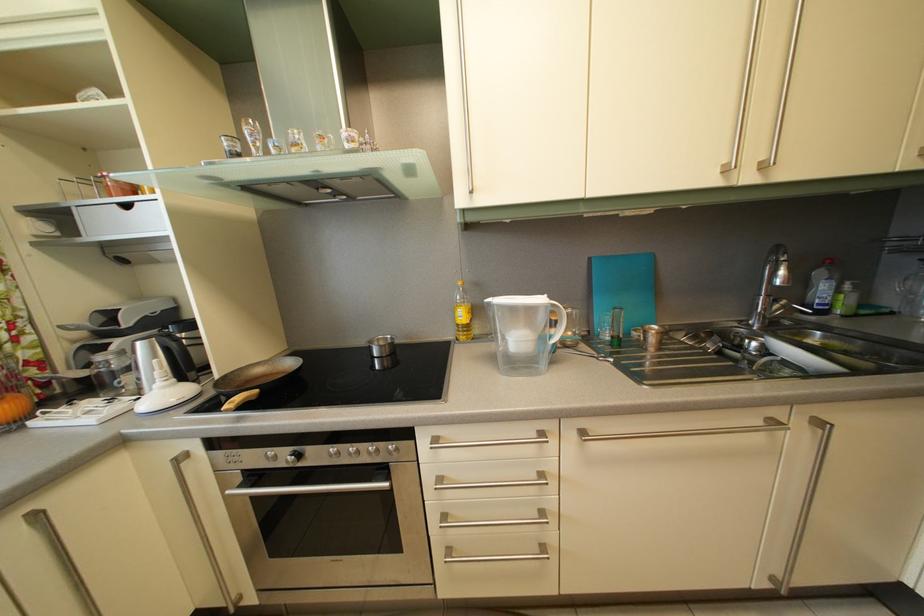
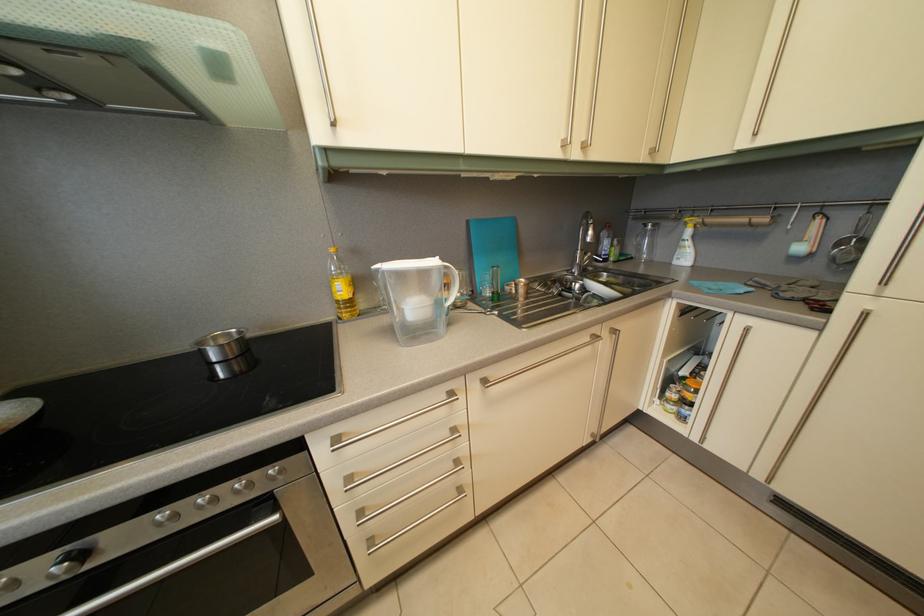
In the second image, find the point that corresponds to pixel 456 559 in the first image.

(380, 549)